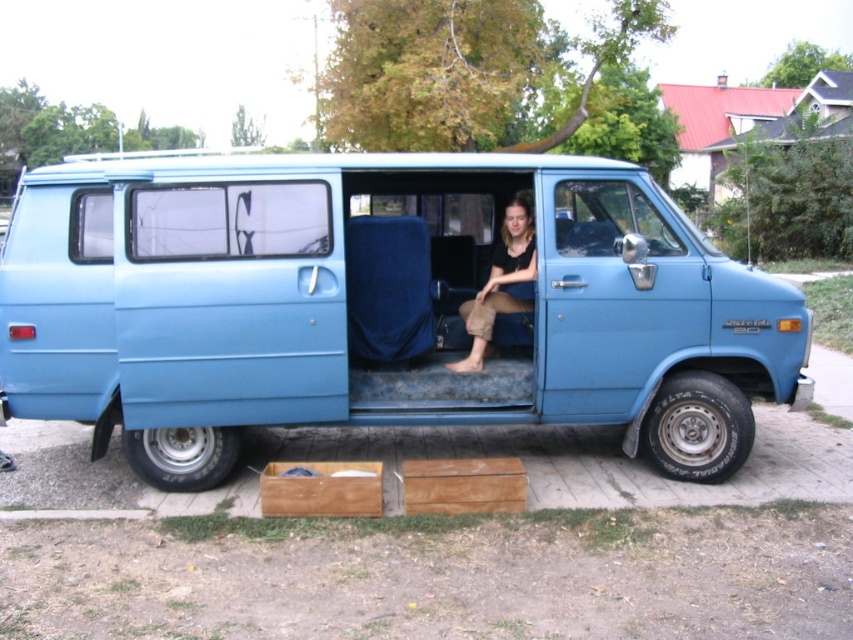
Question: Which point is farther from the camera taking this photo?

Choices:
 (A) (531, 296)
 (B) (254, 408)

Answer: (A)

Question: Does blue matte van at center appear under matte black shirt at center?

Choices:
 (A) no
 (B) yes

Answer: (B)

Question: Which point appears closest to the camera in this image?

Choices:
 (A) (368, 262)
 (B) (468, 307)

Answer: (A)

Question: Is blue matte van at center below matte black shirt at center?

Choices:
 (A) yes
 (B) no

Answer: (A)

Question: Is the position of blue matte van at center less distant than that of matte black shirt at center?

Choices:
 (A) no
 (B) yes

Answer: (B)